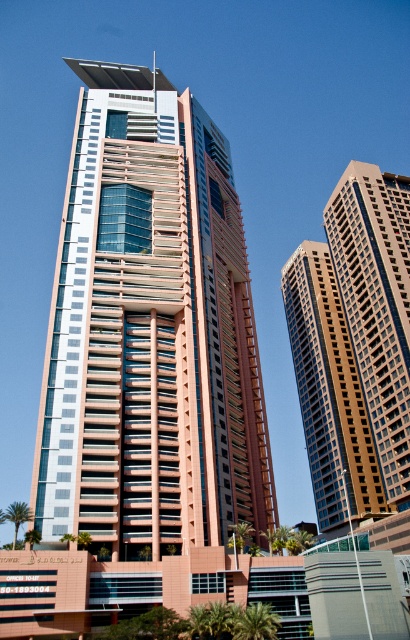
Question: Does matte pink glass building at center have a larger size compared to brown textured building at right?

Choices:
 (A) yes
 (B) no

Answer: (A)

Question: Which is nearer to the matte pink glass building at center?

Choices:
 (A) brown glass building at right
 (B) brown textured building at right

Answer: (B)

Question: Can you confirm if brown textured building at right is positioned below brown glass building at right?

Choices:
 (A) yes
 (B) no

Answer: (B)

Question: Estimate the real-world distances between objects in this image. Which object is closer to the matte pink glass building at center?

Choices:
 (A) brown glass building at right
 (B) brown textured building at right

Answer: (B)

Question: Does brown textured building at right have a larger size compared to brown glass building at right?

Choices:
 (A) no
 (B) yes

Answer: (B)

Question: Which of the following is the closest to the observer?

Choices:
 (A) (195, 225)
 (B) (385, 417)

Answer: (A)